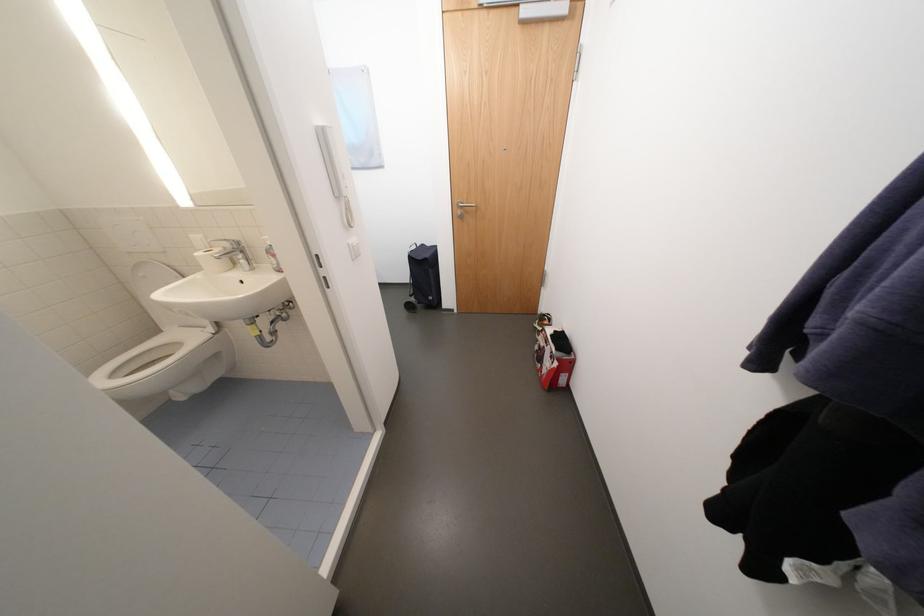
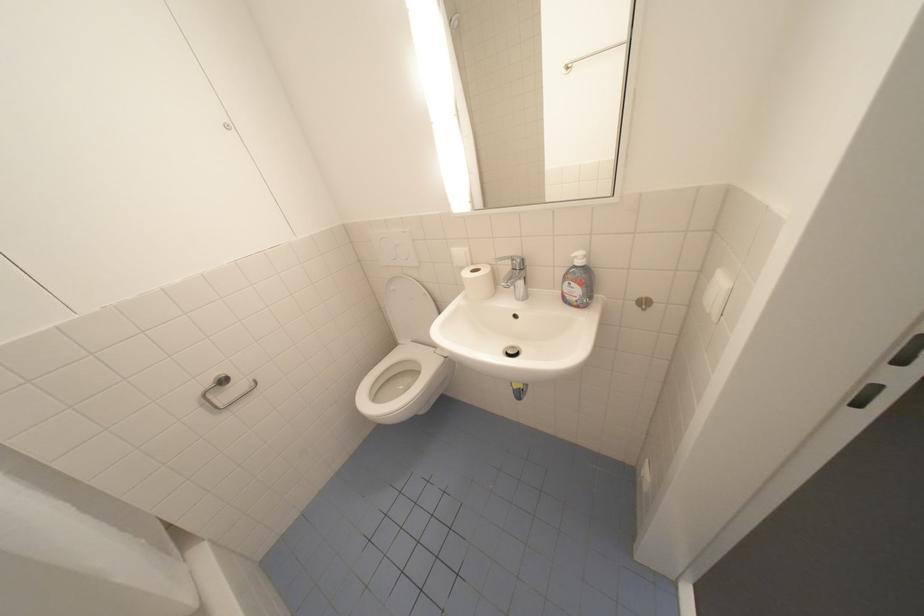
What movement of the cameraman would produce the second image?

The cameraman moved toward left, forward.